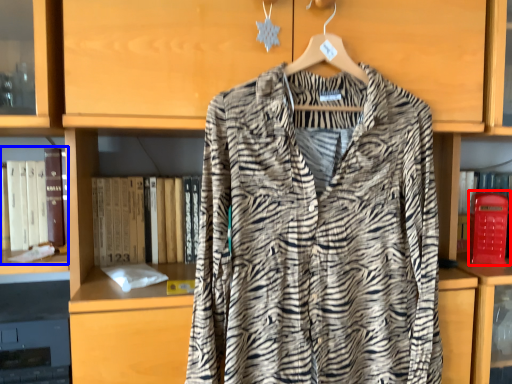
Question: Which of the following is the closest to the observer, phone box (highlighted by a red box) or book (highlighted by a blue box)?

Choices:
 (A) phone box
 (B) book

Answer: (B)